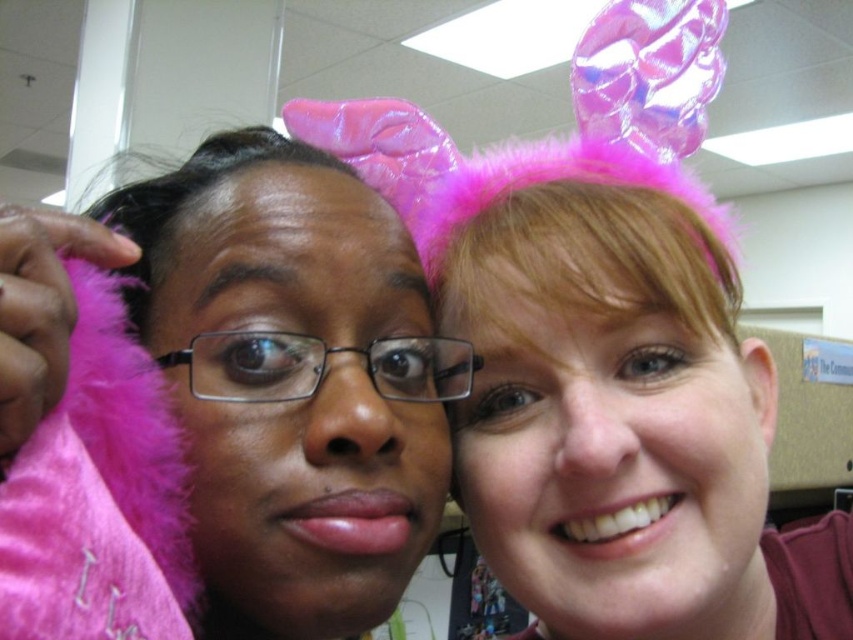
You are standing in an office with two points marked on the wall. The first point is at coordinates point (476, 264) and the second is at point (759, 429). Which point is closer to you?

Point (476, 264) is closer to the viewer than point (759, 429).

Based on the photo, you are an office photographer trying to capture a clear shot of both the pink fluffy headband at upper right and the pink fluffy ear at upper right. Which one is closer to the camera?

The pink fluffy headband at upper right is closer to the camera because it is in front of the pink fluffy ear at upper right.

You are an office photographer trying to capture a clear shot of the two people in the scene. You notice the pink fluffy headband at upper right and the pink fluffy ear at upper right might obstruct the subjects faces. Which of these two items is taller and therefore more likely to block their faces?

The pink fluffy headband at upper right has a greater height compared to the pink fluffy ear at upper right, making it more likely to block their faces.